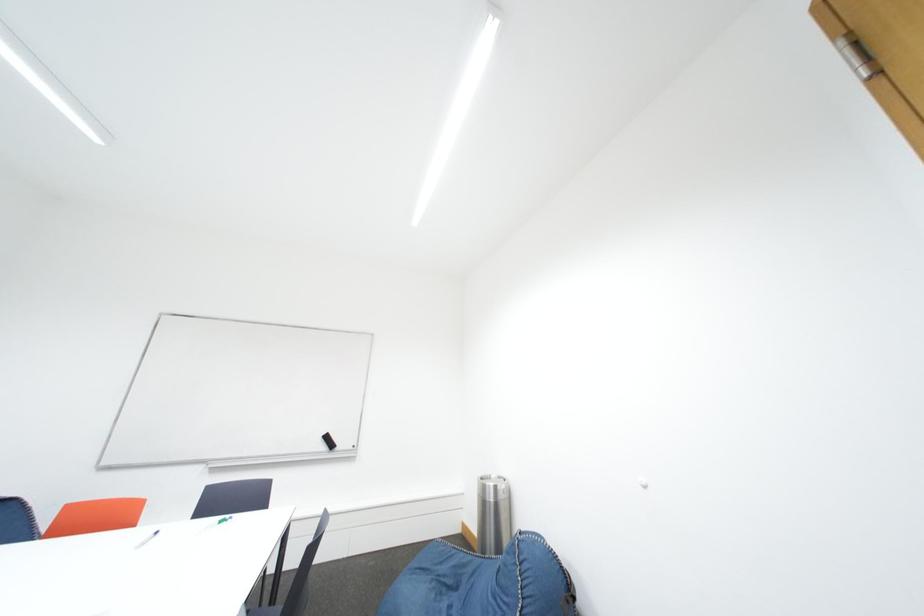
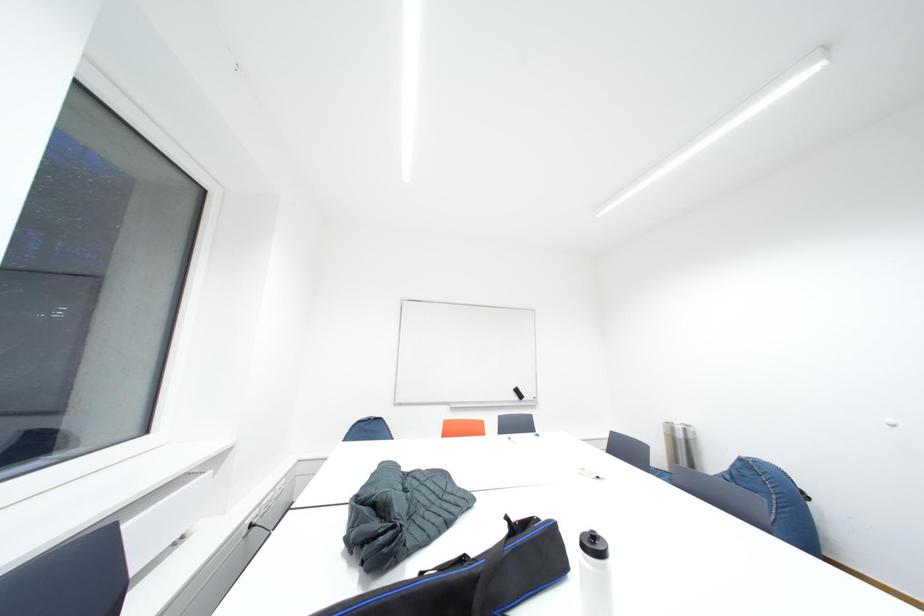
Consider the image. What movement of the cameraman would produce the second image?

The movement direction of the cameraman is left, backward.